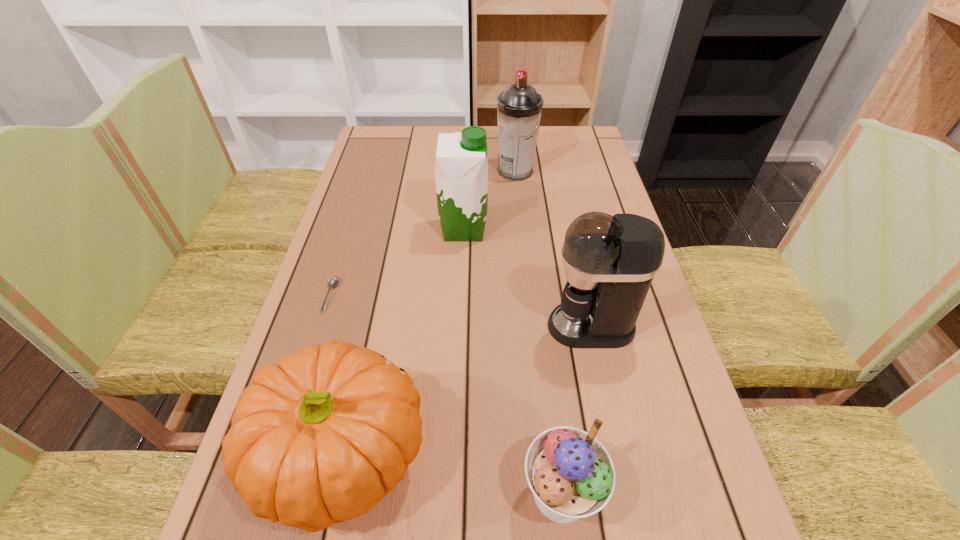
The height and width of the screenshot is (540, 960). Identify the location of the farthest object. (519, 107).

Identify the location of coffee maker. The height and width of the screenshot is (540, 960). (610, 261).

Where is `soya milk`? This screenshot has width=960, height=540. soya milk is located at coordinates (461, 169).

In order to click on icecream in this screenshot , I will do 570,473.

Locate an element on the screen. This screenshot has width=960, height=540. the shortest object is located at coordinates (334, 280).

The width and height of the screenshot is (960, 540). Identify the location of vacant point located 0.070m on the front of the aerosol can. (517, 197).

Image resolution: width=960 pixels, height=540 pixels. In order to click on free space located 0.050m place cup under the spout of the coffee maker in this screenshot , I will do `click(525, 326)`.

You are a GUI agent. You are given a task and a screenshot of the screen. Output one action in this format:
    pyautogui.click(x=<x>, y=<y>)
    Task: Click on the vacant space located 0.230m place cup under the spout of the coffee maker
    
    Given the screenshot: What is the action you would take?
    pyautogui.click(x=444, y=326)

This screenshot has width=960, height=540. What are the coordinates of `vacant region located 0.260m place cup under the spout of the coffee maker` in the screenshot? It's located at (430, 326).

Where is `vacant space located 0.050m on the front-facing side of the soya milk`? vacant space located 0.050m on the front-facing side of the soya milk is located at coordinates (506, 230).